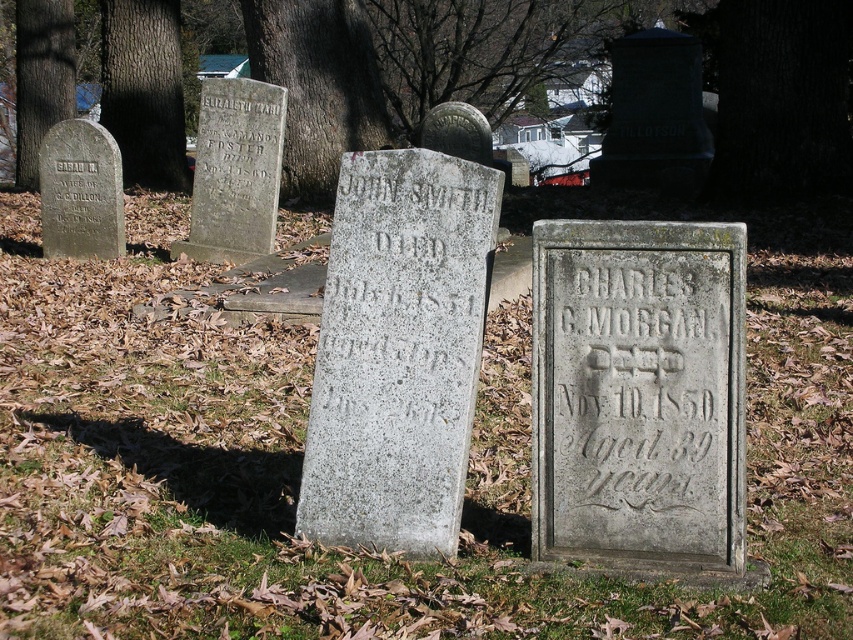
Question: Estimate the real-world distances between objects in this image. Which object is farther from the dark brown bark at upper center?

Choices:
 (A) gray stone gravestone at center
 (B) black stone inscription at center
 (C) gray stone gravestone at upper left

Answer: (B)

Question: Which is nearer to the gray stone gravestone at center?

Choices:
 (A) smooth bark tree trunk at upper left
 (B) gray stone gravestone at upper left
 (C) matte gray gravestone at left

Answer: (B)

Question: Among these points, which one is nearest to the camera?

Choices:
 (A) (x=86, y=225)
 (B) (x=115, y=42)

Answer: (A)

Question: In this image, where is smooth bark tree trunk at upper left located relative to black stone gravestone at left?

Choices:
 (A) left
 (B) right

Answer: (A)

Question: Is green grass at center thinner than dark brown bark at upper center?

Choices:
 (A) yes
 (B) no

Answer: (A)

Question: Is brown rough tree trunk at upper left to the left of smooth bark tree trunk at upper left from the viewer's perspective?

Choices:
 (A) yes
 (B) no

Answer: (B)